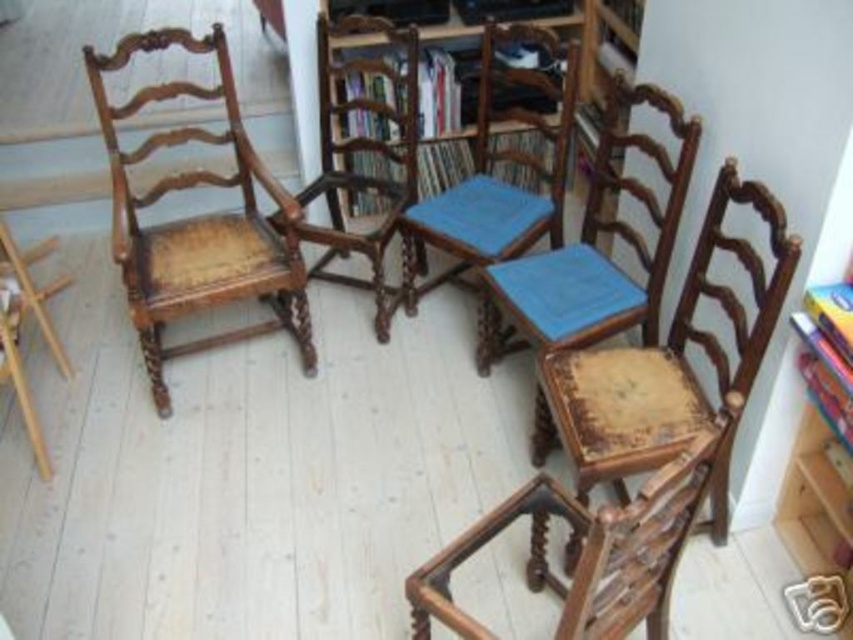
Question: Does wooden woven seat at lower right lie behind wooden textured chair at center?

Choices:
 (A) no
 (B) yes

Answer: (A)

Question: Which object is positioned farthest from the wooden woven seat at lower right?

Choices:
 (A) wooden textured rocking chair at lower right
 (B) rustic wood chair at left

Answer: (B)

Question: Considering the relative positions of rustic wood chair at left and wooden textured rocking chair at lower right in the image provided, where is rustic wood chair at left located with respect to wooden textured rocking chair at lower right?

Choices:
 (A) left
 (B) right

Answer: (A)

Question: Which point appears farthest from the camera in this image?

Choices:
 (A) (561, 186)
 (B) (744, 353)

Answer: (A)

Question: Does wooden textured rocking chair at lower right appear on the right side of wooden textured chair at center?

Choices:
 (A) yes
 (B) no

Answer: (B)

Question: Which object is the farthest from the wooden textured rocking chair at lower right?

Choices:
 (A) wooden woven seat at lower right
 (B) wooden chair with blue cushion at center

Answer: (B)